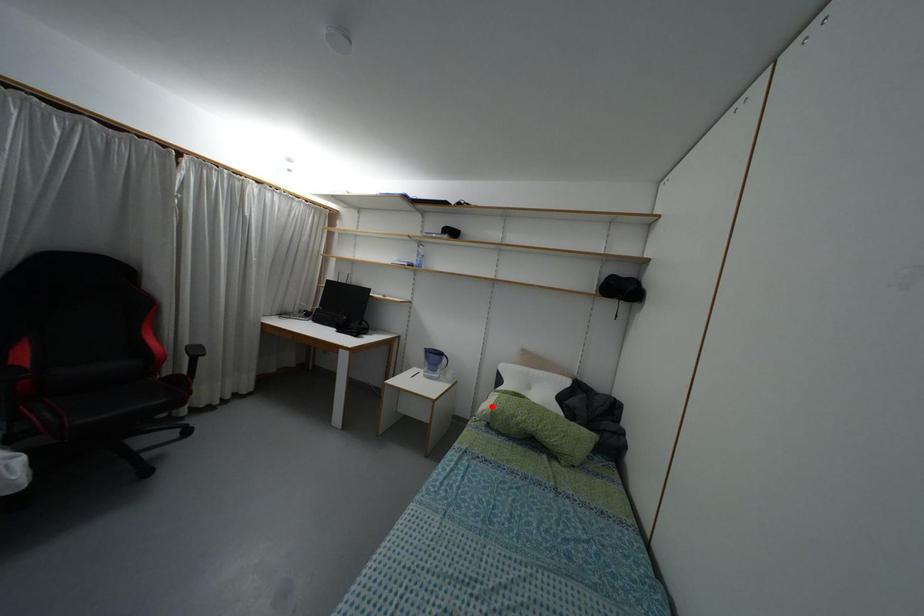
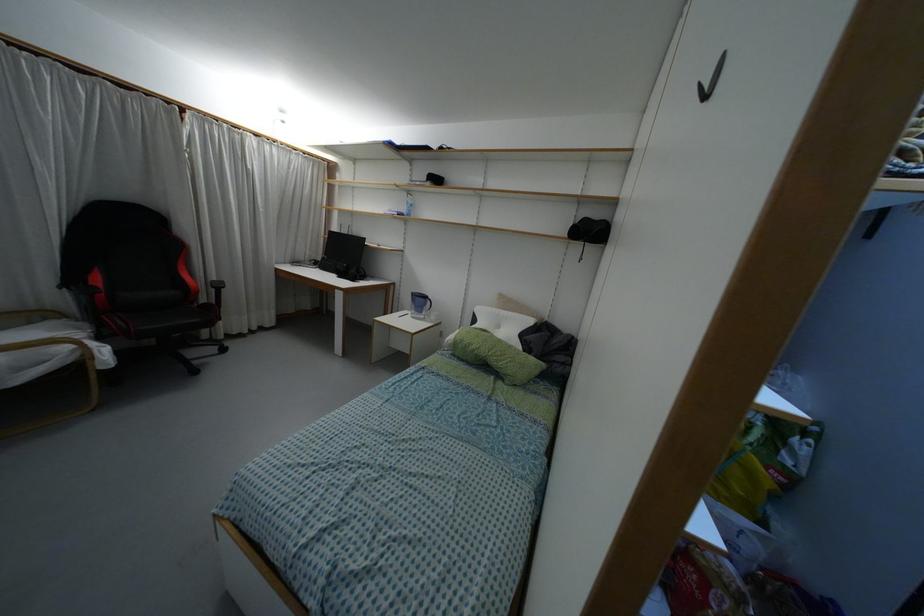
Question: I am providing you with two images of the same scene from different viewpoints. In image1, a red point is highlighted. Considering the same 3D point in image2, which of the following is correct?

Choices:
 (A) It is closer
 (B) It is farther

Answer: (B)